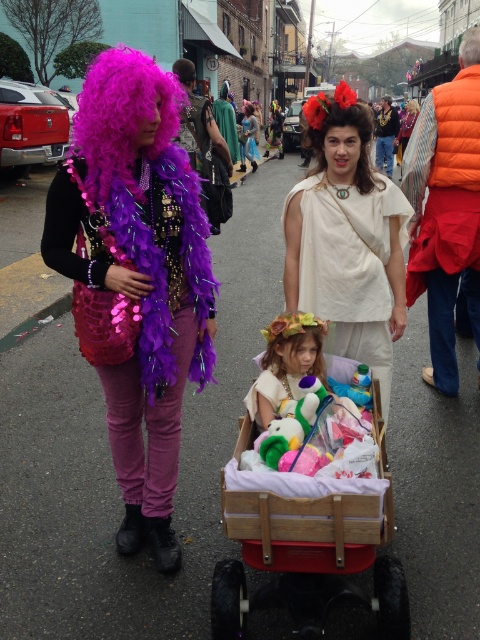
In the scene shown: Does orange quilted vest at upper right appear under fluffy white dress at center?

No, orange quilted vest at upper right is not below fluffy white dress at center.

The height and width of the screenshot is (640, 480). Describe the element at coordinates (445, 216) in the screenshot. I see `orange quilted vest at upper right` at that location.

Identify the location of orange quilted vest at upper right. The height and width of the screenshot is (640, 480). coord(445,216).

Is point (299, 630) farther from camera compared to point (388, 136)?

No, (299, 630) is in front of (388, 136).

Which is more to the left, wooden cart at center or velvet gold vest at center?

From the viewer's perspective, wooden cart at center appears more on the left side.

Is point (331, 508) positioned before point (388, 168)?

Yes, it is.

Where is `wooden cart at center`? The width and height of the screenshot is (480, 640). wooden cart at center is located at coordinates (310, 532).

Between point (268, 588) and point (255, 120), which one is positioned behind?

Positioned behind is point (255, 120).

Which is below, wooden cart at center or shiny metallic mask at center?

Positioned lower is wooden cart at center.

The image size is (480, 640). Identify the location of wooden cart at center. (310, 532).

The image size is (480, 640). I want to click on wooden cart at center, so click(x=310, y=532).